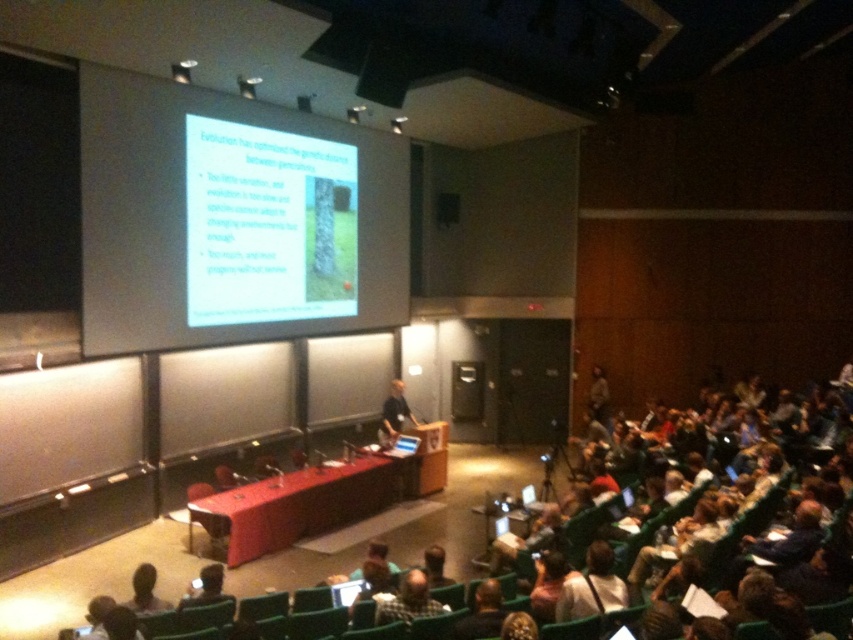
You are an attendee in the lecture hall. You notice the white matte projector screen at upper center and the black fabric shirt at center. Which object is wider?

The white matte projector screen at upper center is wider than the black fabric shirt at center.

You are a student sitting in the lecture hall and notice a point marked at coordinates (206, 588). What object is located at that point?

The point at coordinates (206, 588) marks the matte black laptop at lower left.